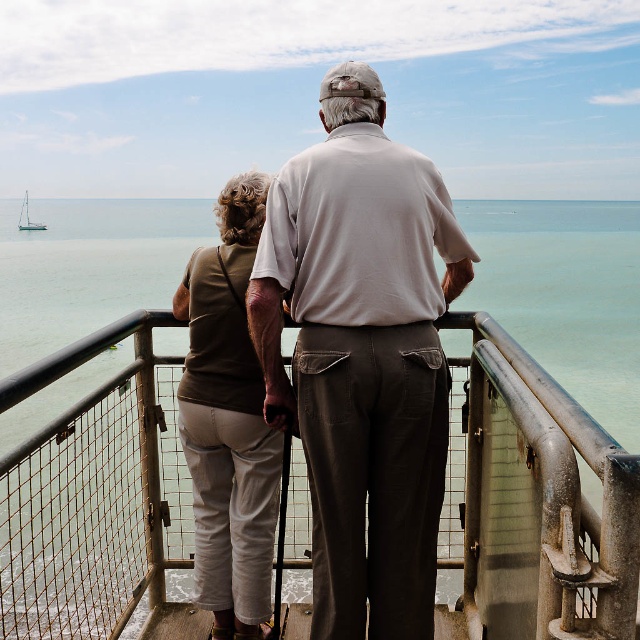
Who is more forward, (x=124, y=520) or (x=396, y=307)?

Point (x=396, y=307)

You are a GUI agent. You are given a task and a screenshot of the screen. Output one action in this format:
    pyautogui.click(x=<x>, y=<y>)
    Task: Click on the metallic silver railing at center
    This screenshot has height=640, width=640.
    Given the screenshot: What is the action you would take?
    pyautogui.click(x=532, y=502)

Who is higher up, white cotton shirt at center or matte green shirt at center?

white cotton shirt at center is above.

Can you confirm if white cotton shirt at center is positioned to the right of matte green shirt at center?

Yes, white cotton shirt at center is to the right of matte green shirt at center.

Image resolution: width=640 pixels, height=640 pixels. I want to click on white cotton shirt at center, so click(x=362, y=355).

This screenshot has width=640, height=640. I want to click on white cotton shirt at center, so click(x=362, y=355).

This screenshot has width=640, height=640. Describe the element at coordinates (228, 420) in the screenshot. I see `matte green shirt at center` at that location.

Does matte green shirt at center have a greater height compared to white sailboat at left?

In fact, matte green shirt at center may be shorter than white sailboat at left.

This screenshot has height=640, width=640. Describe the element at coordinates (228, 420) in the screenshot. I see `matte green shirt at center` at that location.

Locate an element on the screen. matte green shirt at center is located at coordinates (228, 420).